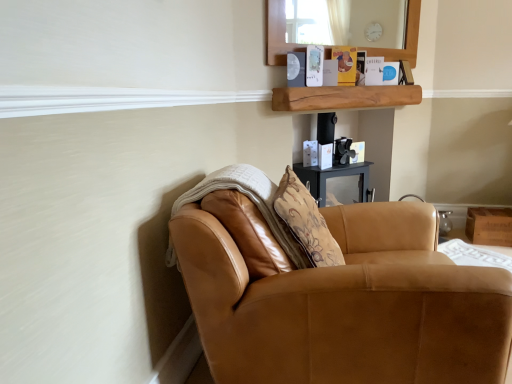
Question: From the image's perspective, is wooden box at lower right on saddle brown leather chair at lower right?

Choices:
 (A) yes
 (B) no

Answer: (A)

Question: Does wooden box at lower right lie in front of saddle brown leather chair at lower right?

Choices:
 (A) no
 (B) yes

Answer: (A)

Question: Is wooden box at lower right taller than saddle brown leather chair at lower right?

Choices:
 (A) yes
 (B) no

Answer: (B)

Question: From the image's perspective, would you say wooden box at lower right is shown under saddle brown leather chair at lower right?

Choices:
 (A) yes
 (B) no

Answer: (B)

Question: Could saddle brown leather chair at lower right be considered to be inside wooden box at lower right?

Choices:
 (A) no
 (B) yes

Answer: (A)

Question: Is wooden box at lower right not near saddle brown leather chair at lower right?

Choices:
 (A) no
 (B) yes

Answer: (B)

Question: Is saddle brown leather chair at lower right aimed at wooden box at lower right?

Choices:
 (A) no
 (B) yes

Answer: (A)

Question: Can you confirm if saddle brown leather chair at lower right is thinner than wooden box at lower right?

Choices:
 (A) no
 (B) yes

Answer: (A)

Question: From the image's perspective, is saddle brown leather chair at lower right above wooden box at lower right?

Choices:
 (A) yes
 (B) no

Answer: (B)

Question: Is saddle brown leather chair at lower right turned away from wooden box at lower right?

Choices:
 (A) yes
 (B) no

Answer: (B)

Question: Is saddle brown leather chair at lower right smaller than wooden box at lower right?

Choices:
 (A) no
 (B) yes

Answer: (A)

Question: Can you confirm if saddle brown leather chair at lower right is taller than wooden box at lower right?

Choices:
 (A) yes
 (B) no

Answer: (A)

Question: From a real-world perspective, is natural wood shelf at upper center positioned over saddle brown leather chair at lower right based on gravity?

Choices:
 (A) yes
 (B) no

Answer: (A)